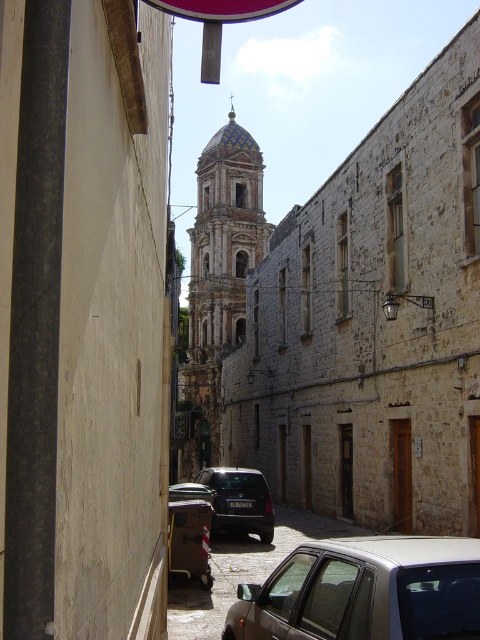
You are a tourist standing at the end of the street looking towards the center. You see the golden mosaic dome at center and the metallic car at center. Which object is closer to the left side of the street?

The golden mosaic dome at center is closer to the left side of the street because it is positioned to the left of the metallic car at center.

You are driving a metallic car at center and want to turn left onto a side street that is just beyond the stone tower at center. Can you see the entrance to the side street clearly from your current position?

The metallic car at center is behind the stone tower at center, so you cannot see the entrance to the side street clearly from your current position.